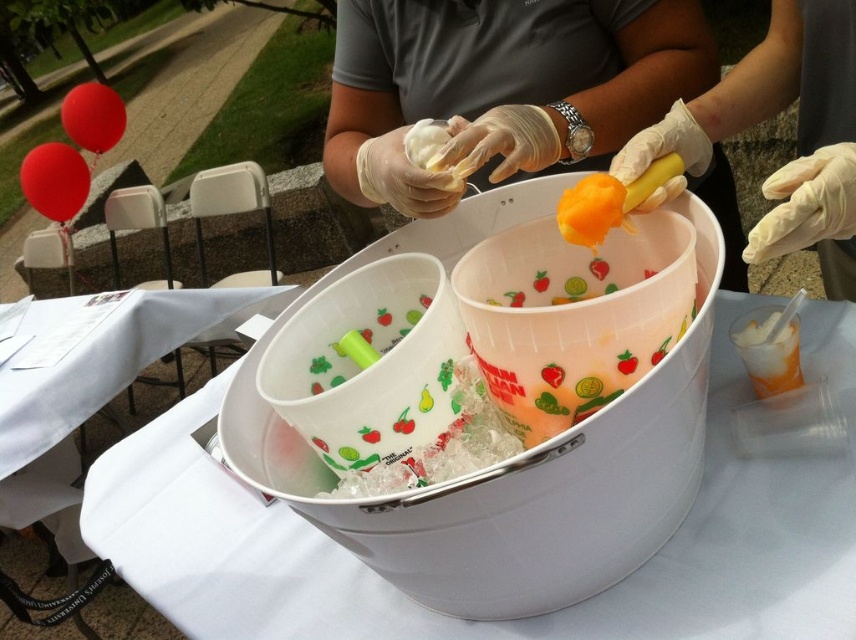
Is white plastic bucket at center behind white latex gloves at upper right?

No, white plastic bucket at center is in front of white latex gloves at upper right.

At what (x,y) coordinates should I click in order to perform the action: click on white plastic bucket at center. Please return your answer as a coordinate pair (x, y). The width and height of the screenshot is (856, 640). Looking at the image, I should click on (456, 618).

Does point (214, 467) come farther from viewer compared to point (572, 212)?

Yes, point (214, 467) is behind point (572, 212).

Consider the image. Can you confirm if white plastic bucket at center is positioned below orange gelatinous substance at center?

Yes.

Is point (821, 573) positioned behind point (575, 212)?

No, it is not.

This screenshot has width=856, height=640. I want to click on white plastic bucket at center, so click(456, 618).

Is white plastic bucket at center thinner than matte white gloves at upper center?

Incorrect, white plastic bucket at center's width is not less than matte white gloves at upper center's.

The width and height of the screenshot is (856, 640). Describe the element at coordinates (456, 618) in the screenshot. I see `white plastic bucket at center` at that location.

Locate an element on the screen. The height and width of the screenshot is (640, 856). white plastic bucket at center is located at coordinates (456, 618).